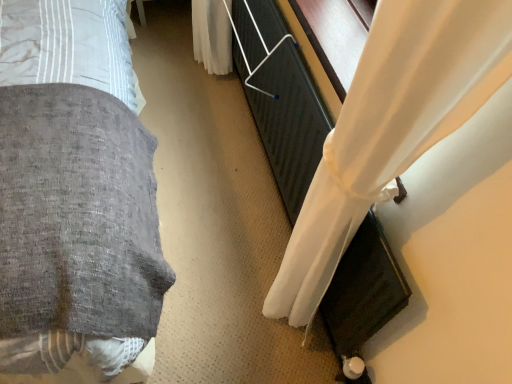
Question: From a real-world perspective, is textured gray blanket at left located higher than white sheer curtain at right?

Choices:
 (A) yes
 (B) no

Answer: (A)

Question: Is textured gray blanket at left not within white sheer curtain at right?

Choices:
 (A) no
 (B) yes

Answer: (B)

Question: Does textured gray blanket at left touch white sheer curtain at right?

Choices:
 (A) yes
 (B) no

Answer: (B)

Question: Does textured gray blanket at left lie behind white sheer curtain at right?

Choices:
 (A) no
 (B) yes

Answer: (A)

Question: Is textured gray blanket at left to the left of white sheer curtain at right from the viewer's perspective?

Choices:
 (A) yes
 (B) no

Answer: (A)

Question: Is textured gray blanket at left bigger than white sheer curtain at right?

Choices:
 (A) no
 (B) yes

Answer: (B)

Question: From the image's perspective, is white sheer curtain at right on textured gray blanket at left?

Choices:
 (A) yes
 (B) no

Answer: (B)

Question: Is white sheer curtain at right outside of textured gray blanket at left?

Choices:
 (A) yes
 (B) no

Answer: (A)

Question: Does white sheer curtain at right have a larger size compared to textured gray blanket at left?

Choices:
 (A) no
 (B) yes

Answer: (A)

Question: Is white sheer curtain at right thinner than textured gray blanket at left?

Choices:
 (A) yes
 (B) no

Answer: (A)

Question: Can textured gray blanket at left be found inside white sheer curtain at right?

Choices:
 (A) yes
 (B) no

Answer: (B)

Question: From the image's perspective, is white sheer curtain at right beneath textured gray blanket at left?

Choices:
 (A) no
 (B) yes

Answer: (B)

Question: Is textured gray blanket at left situated inside white sheer curtain at right or outside?

Choices:
 (A) outside
 (B) inside

Answer: (A)